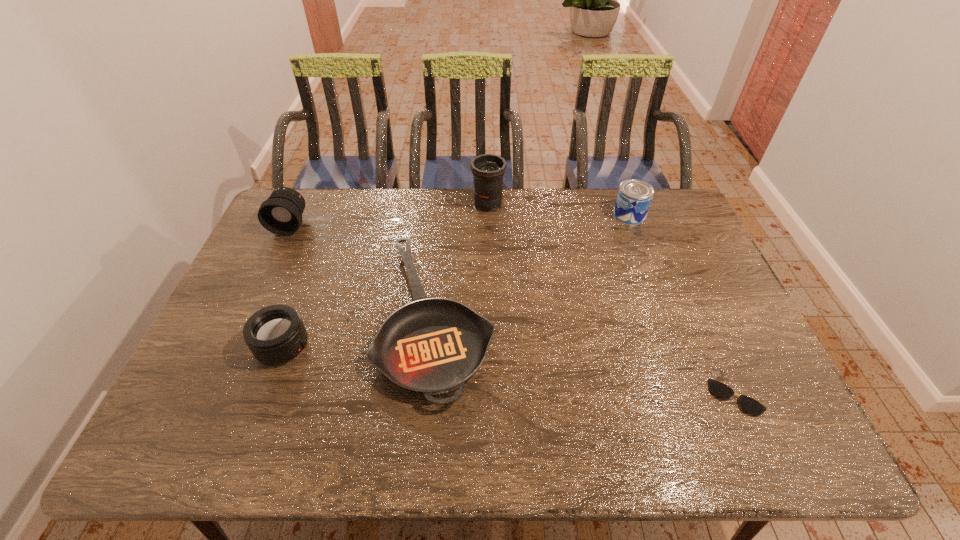
The height and width of the screenshot is (540, 960). I want to click on object that is at the far right corner, so click(x=634, y=197).

You are a GUI agent. You are given a task and a screenshot of the screen. Output one action in this format:
    pyautogui.click(x=<x>, y=<y>)
    Task: Click on the free location at the far edge
    The height and width of the screenshot is (540, 960).
    Given the screenshot: What is the action you would take?
    pyautogui.click(x=382, y=205)

In the image, there is a desktop. At what (x,y) coordinates should I click in order to perform the action: click on vacant space at the near edge. Please return your answer as a coordinate pair (x, y). Looking at the image, I should click on (269, 442).

In the image, there is a desktop. Find the location of `free region at the left edge`. free region at the left edge is located at coordinates (215, 350).

I want to click on vacant area at the right edge, so click(689, 255).

In the image, there is a desktop. Find the location of `vacant space at the far left corner`. vacant space at the far left corner is located at coordinates [x=312, y=198].

Identify the location of free space at the near left corner of the desktop. (203, 440).

In the image, there is a desktop. Identify the location of vacant area at the far right corner. (664, 204).

At what (x,y) coordinates should I click in order to perform the action: click on vacant region between the second tallest telephoto lens and the nearest telephoto lens. Please return your answer as a coordinate pair (x, y). Image resolution: width=960 pixels, height=540 pixels. Looking at the image, I should click on (287, 286).

You are a GUI agent. You are given a task and a screenshot of the screen. Output one action in this format:
    pyautogui.click(x=<x>, y=<y>)
    Task: Click on the free point between the tallest telephoto lens and the fifth shortest object
    Image resolution: width=960 pixels, height=540 pixels.
    Given the screenshot: What is the action you would take?
    pyautogui.click(x=389, y=214)